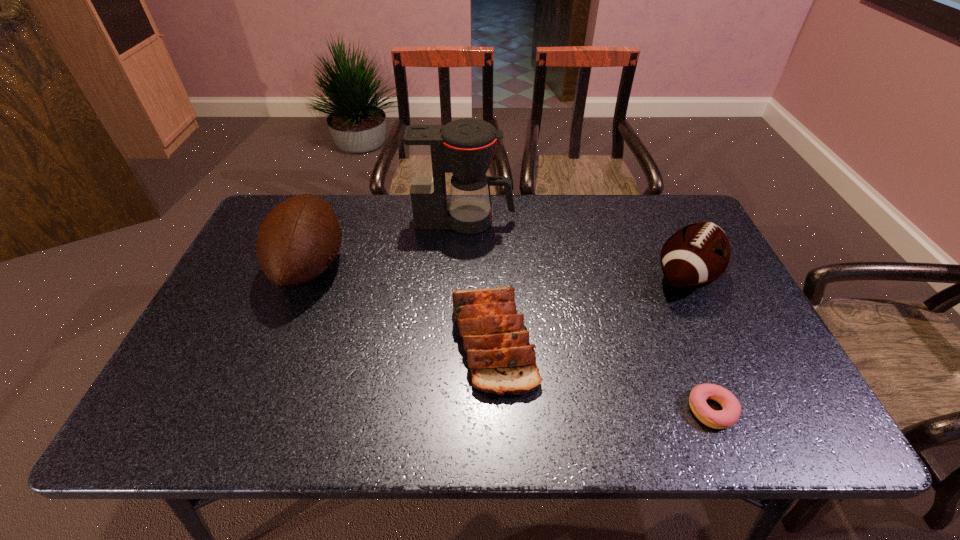
At what (x,y) coordinates should I click in order to perform the action: click on unoccupied position between the right football (American) and the bread. Please return your answer as a coordinate pair (x, y). The width and height of the screenshot is (960, 540). Looking at the image, I should click on (589, 308).

Locate an element on the screen. This screenshot has height=540, width=960. free space between the coffee maker and the bread is located at coordinates (x=479, y=281).

The image size is (960, 540). I want to click on empty location between the bread and the shorter football (American), so click(x=589, y=308).

In order to click on vacant region between the right football (American) and the leftmost object in this screenshot , I will do `click(498, 272)`.

In order to click on object identified as the second closest to the second shortest object in this screenshot , I will do pos(731,411).

Image resolution: width=960 pixels, height=540 pixels. What are the coordinates of `object that is the third closest to the right football (American)` in the screenshot? It's located at (465, 147).

This screenshot has width=960, height=540. What are the coordinates of `vacant space that satisfies the following two spatial constraints: 1. pour from the carafe of the tallest object; 2. on the back side of the bread` in the screenshot? It's located at (460, 340).

The image size is (960, 540). What are the coordinates of `free spot that satisfies the following two spatial constraints: 1. on the laces of the second tallest object; 2. on the right side of the second shortest object` in the screenshot? It's located at (281, 340).

Where is `vacant area that satisfies the following two spatial constraints: 1. pour from the carafe of the shorter football (American); 2. on the right side of the coffee maker`? The height and width of the screenshot is (540, 960). vacant area that satisfies the following two spatial constraints: 1. pour from the carafe of the shorter football (American); 2. on the right side of the coffee maker is located at coordinates (463, 277).

At what (x,y) coordinates should I click in order to perform the action: click on vacant space that satisfies the following two spatial constraints: 1. on the back side of the bread; 2. pour from the carafe of the tallest object. Please return your answer as a coordinate pair (x, y). Looking at the image, I should click on (491, 221).